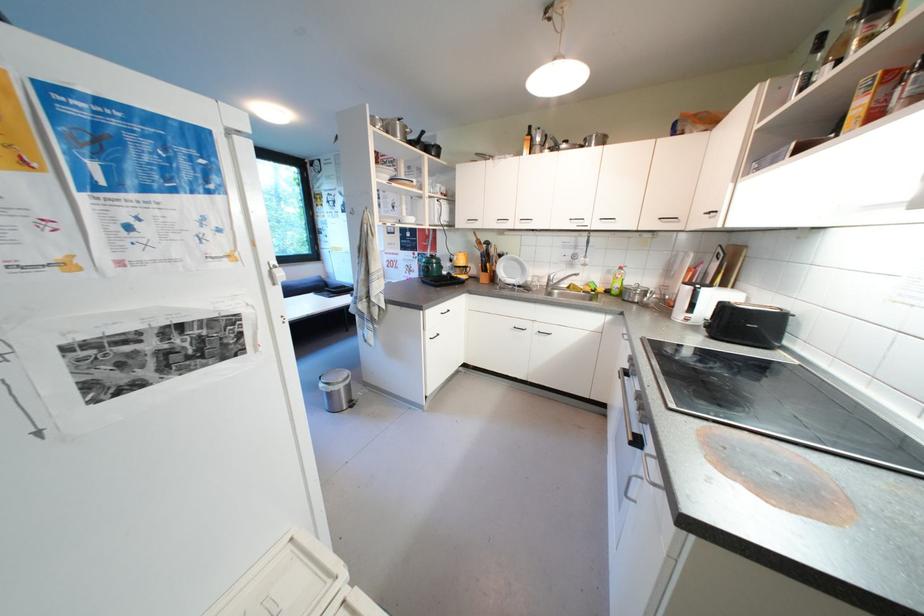
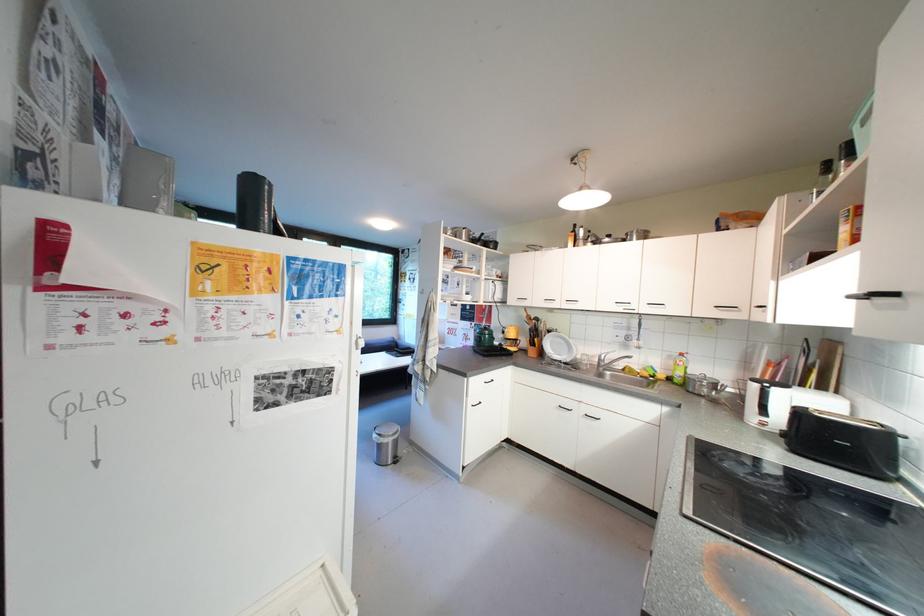
The images are taken continuously from a first-person perspective. In which direction are you moving?

The movement direction of the cameraman is right, backward.